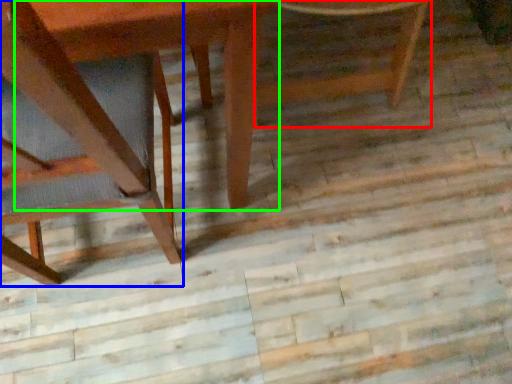
Question: Considering the real-world distances, which object is farthest from chair (highlighted by a red box)? chair (highlighted by a blue box) or round table (highlighted by a green box)?

Choices:
 (A) chair
 (B) round table

Answer: (A)